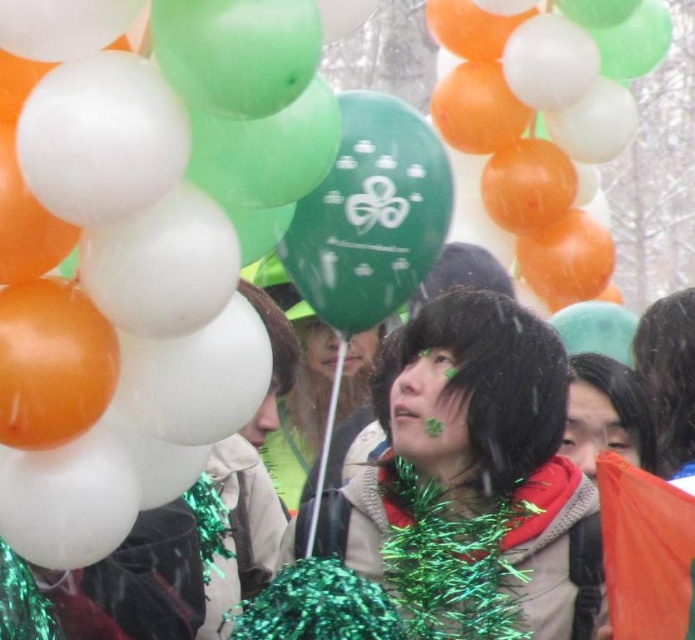
I want to click on shiny green tinsel at center, so click(x=480, y=451).

Between shiny green tinsel at center and matte black scarf at center, which one appears on the left side from the viewer's perspective?

shiny green tinsel at center

Measure the distance between point (343,506) and camera.

Point (343,506) is 99.56 feet away from camera.

Locate an element on the screen. Image resolution: width=695 pixels, height=640 pixels. shiny green tinsel at center is located at coordinates pos(480,451).